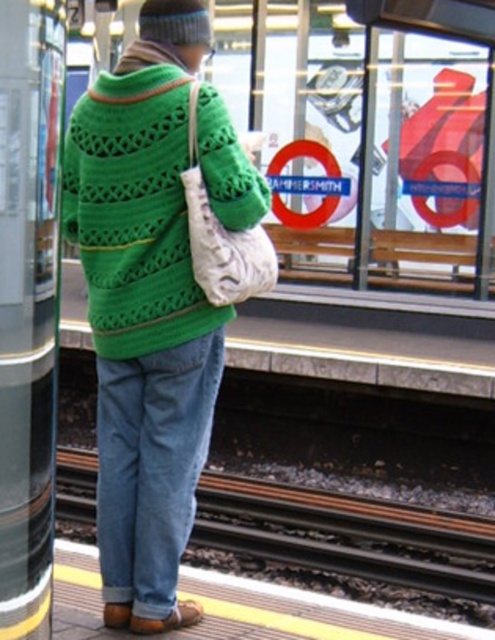
What do you see at coordinates (352, 540) in the screenshot?
I see `metal train track at lower center` at bounding box center [352, 540].

Who is more distant from viewer, (209, 541) or (119, 419)?

The point (209, 541) is behind.

Where is `metal train track at lower center`? metal train track at lower center is located at coordinates (352, 540).

Does green knitted cardigan at center come in front of denim at center?

Yes.

Who is more forward, (221, 214) or (154, 355)?

Point (221, 214)

The image size is (495, 640). Identify the location of green knitted cardigan at center. (135, 209).

Find the location of a particular element. green knitted cardigan at center is located at coordinates (135, 209).

Can you confirm if green knitted cardigan at center is smaller than metal train track at lower center?

Yes, green knitted cardigan at center is smaller than metal train track at lower center.

Is point (71, 195) closer to camera compared to point (453, 592)?

Yes, it is.

Does point (102, 262) come farther from viewer compared to point (94, 516)?

No, it is not.

Locate an element on the screen. This screenshot has width=495, height=640. green knitted cardigan at center is located at coordinates (135, 209).